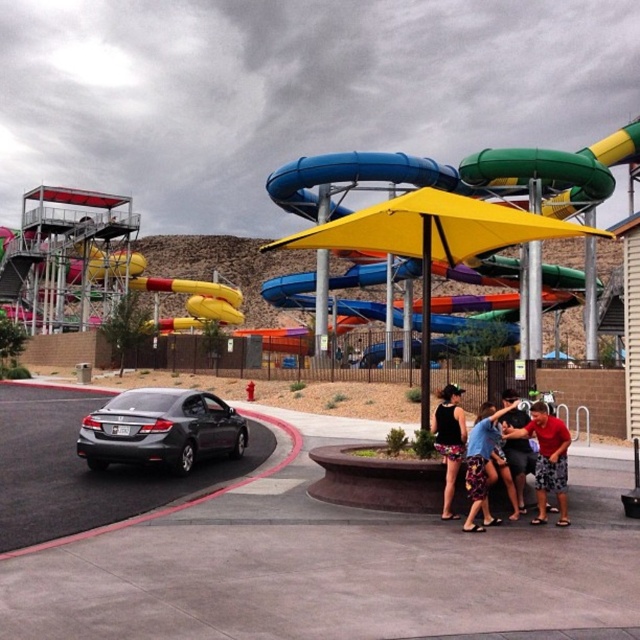
Who is more distant from viewer, (502, 461) or (451, 413)?

The point (451, 413) is more distant.

Is point (483, 509) positioned before point (440, 433)?

Yes, point (483, 509) is in front of point (440, 433).

Is point (474, 454) positioned behind point (460, 426)?

No.

At what (x,y) coordinates should I click in order to perform the action: click on floral skirt at lower center. Please return your answer as a coordinate pair (x, y). The image size is (640, 640). Looking at the image, I should click on (484, 465).

Between yellow fabric umbrella at center and floral skirt at lower center, which one has more height?

Standing taller between the two is yellow fabric umbrella at center.

Based on the photo, who is positioned more to the left, yellow fabric umbrella at center or floral skirt at lower center?

floral skirt at lower center is more to the left.

Where is `yellow fabric umbrella at center`? yellow fabric umbrella at center is located at coordinates (433, 241).

Which is more to the right, matte black sedan at left or matte black shirt at lower right?

Positioned to the right is matte black shirt at lower right.

Find the location of a particular element. Image resolution: width=640 pixels, height=640 pixels. matte black sedan at left is located at coordinates (161, 429).

Find the location of `matte black sedan at left`. matte black sedan at left is located at coordinates (161, 429).